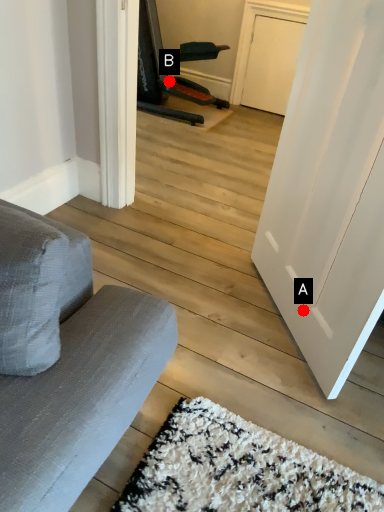
Question: Two points are circled on the image, labeled by A and B beside each circle. Which point is closer to the camera taking this photo?

Choices:
 (A) A is closer
 (B) B is closer

Answer: (A)